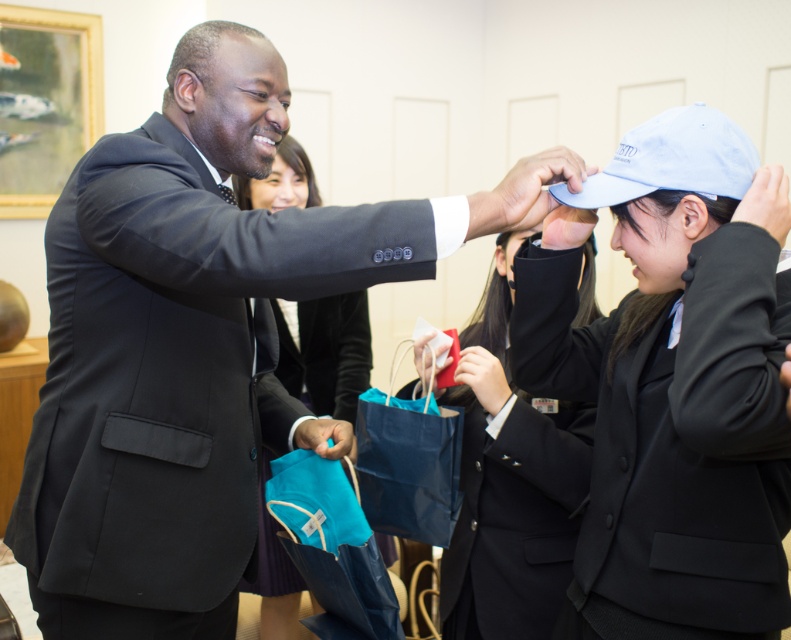
Question: Is matte blue shopping bag at center smaller than light blue fabric baseball cap at upper right?

Choices:
 (A) yes
 (B) no

Answer: (B)

Question: Which is nearer to the matte black blazer at center?

Choices:
 (A) matte blue shopping bag at center
 (B) blue paper bag at center
 (C) black satin tie at upper center
 (D) black matte business suit at center

Answer: (B)

Question: Which is nearer to the light blue fabric baseball cap at upper right?

Choices:
 (A) matte blue shopping bag at center
 (B) matte black blazer at center

Answer: (A)

Question: Does black matte business suit at center appear on the right side of light blue fabric baseball cap at upper right?

Choices:
 (A) no
 (B) yes

Answer: (A)

Question: Does black matte business suit at center appear under matte black blazer at center?

Choices:
 (A) yes
 (B) no

Answer: (A)

Question: Which object is farther from the camera taking this photo?

Choices:
 (A) black matte suit at center
 (B) blue matte cap at upper right
 (C) matte black blazer at center
 (D) light blue fabric baseball cap at upper right

Answer: (C)